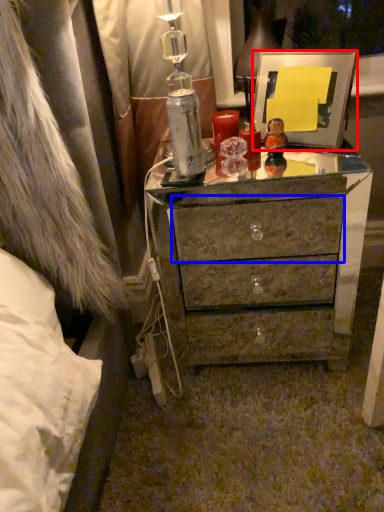
Question: Which object appears farthest to the camera in this image, picture frame (highlighted by a red box) or drawer (highlighted by a blue box)?

Choices:
 (A) picture frame
 (B) drawer

Answer: (B)